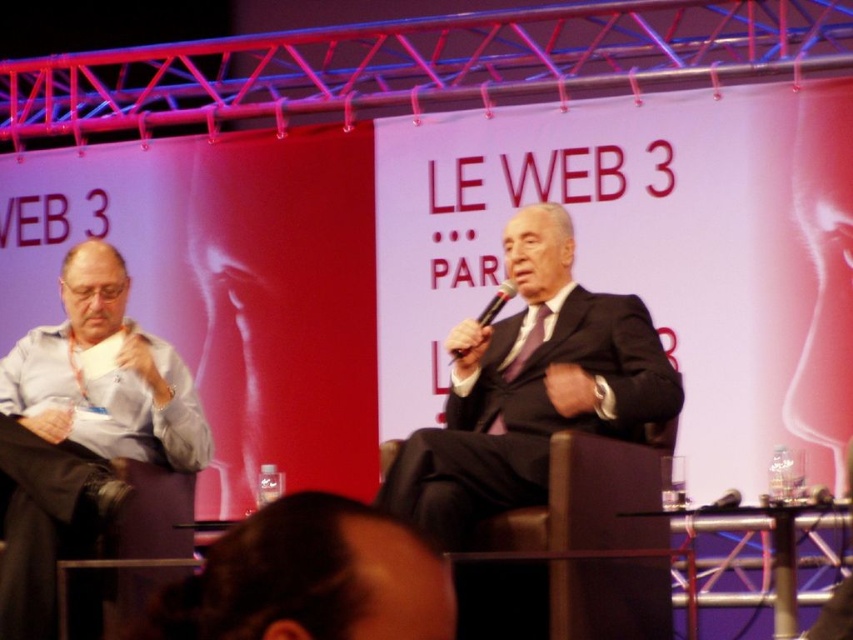
Based on the photo, you are a stagehand responsible for adjusting the microphone stand during the panel discussion. The blue shirt at left is currently speaking and needs to move closer to the black plastic microphone at center to ensure their voice is heard clearly. How much closer should they move to be at the optimal distance of 0.5 meters from the microphone?

The blue shirt at left is currently 1.75 meters away from the black plastic microphone at center. To reach the optimal distance of 0.5 meters, they need to move 1.25 meters closer.

You are a photographer positioned at the back of the stage during the Le Web 3 event. You want to capture a clear photo of the matte black suit at center and the black plastic microphone at center. Which object will appear larger in your photo?

The matte black suit at center will appear larger in the photo because it is closer to the viewer than the black plastic microphone at center.